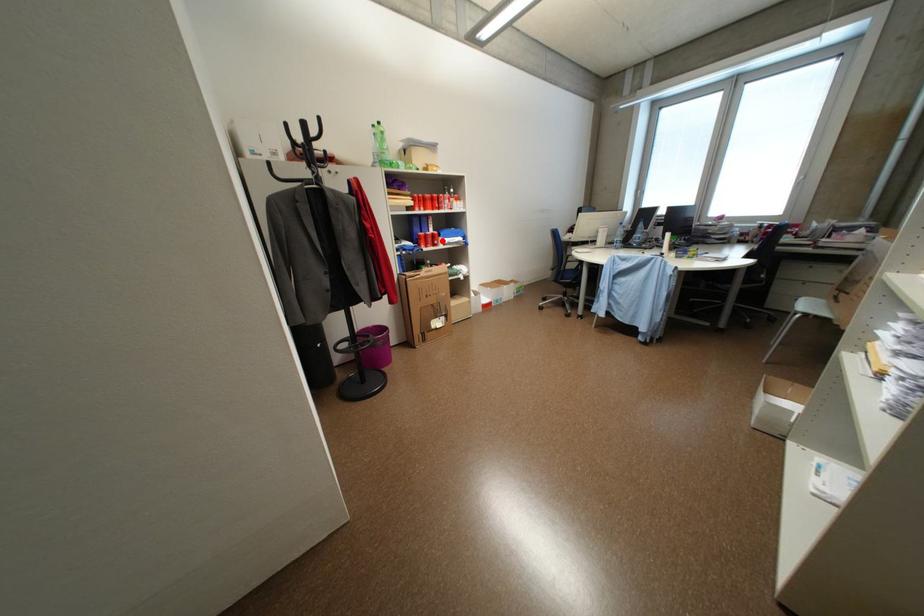
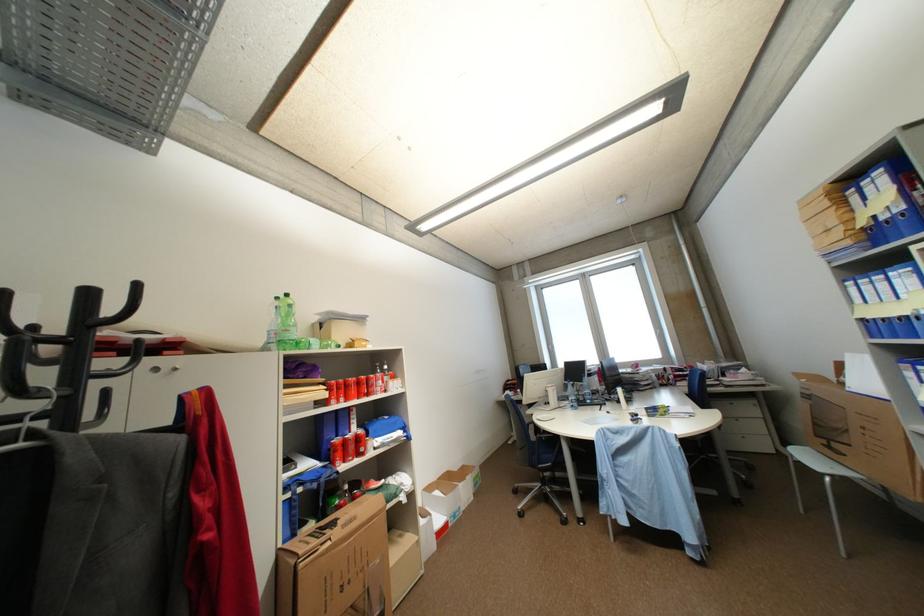
Find the pixel in the second image that matches the highlighted location in the first image.

(368, 447)